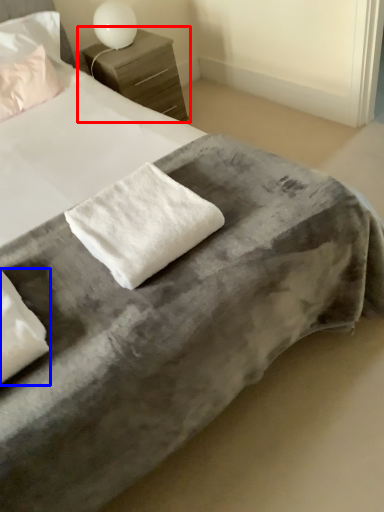
Question: Among these objects, which one is nearest to the camera, nightstand (highlighted by a red box) or pillow (highlighted by a blue box)?

Choices:
 (A) nightstand
 (B) pillow

Answer: (B)